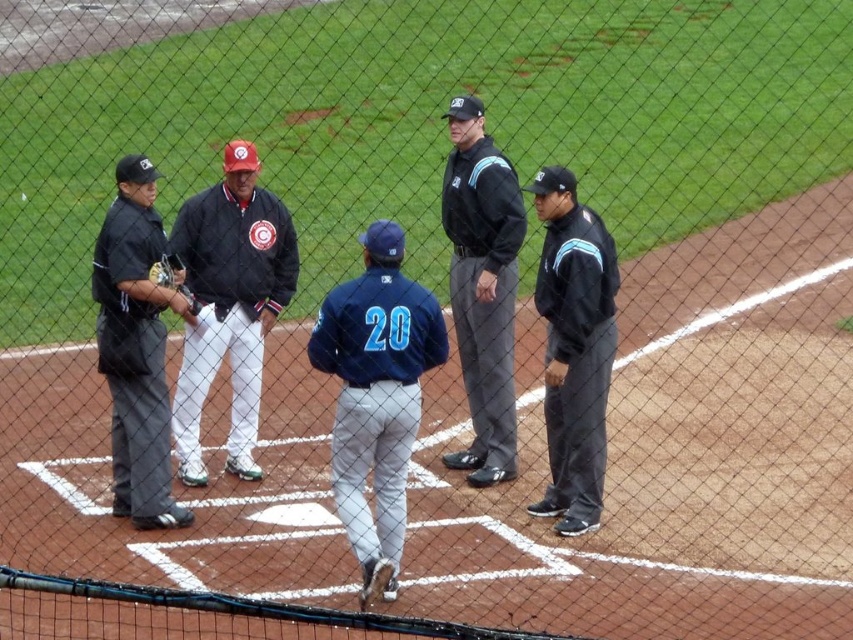
Question: Observing the image, what is the correct spatial positioning of black smooth uniform at center in reference to dark brown leather glove at left?

Choices:
 (A) right
 (B) left

Answer: (A)

Question: Which of the following is the closest to the observer?

Choices:
 (A) matte black jacket at center
 (B) dark blue jersey at center

Answer: (A)

Question: Which object is positioned closest to the matte black jacket at center?

Choices:
 (A) dark blue jersey at center
 (B) black smooth uniform at center
 (C) black leather jacket at center
 (D) black uniformed man at left

Answer: (B)

Question: Is dark blue jersey at center below brown leather glove at left?

Choices:
 (A) no
 (B) yes

Answer: (B)

Question: Considering the relative positions of dark blue jersey at center and black leather jacket at center in the image provided, where is dark blue jersey at center located with respect to black leather jacket at center?

Choices:
 (A) above
 (B) below

Answer: (A)

Question: Which object is closer to the camera taking this photo?

Choices:
 (A) brown leather glove at left
 (B) black leather jacket at center
 (C) dark brown leather glove at left

Answer: (A)